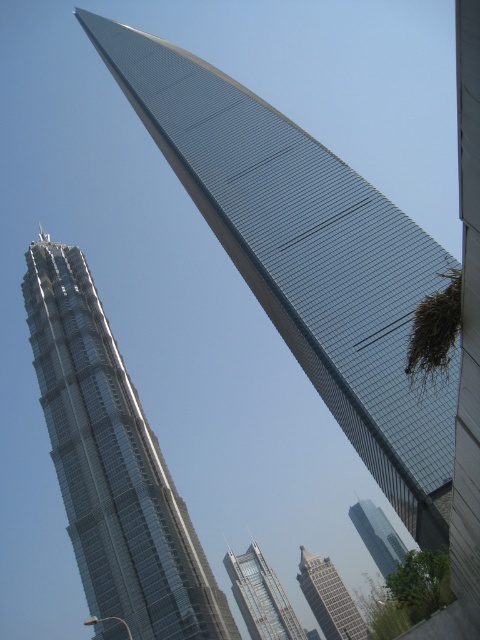
You are standing at the base of the Shanghai Tower and want to take a photo of both point (331,410) and point (384,525) in the frame. Which point will appear closer to you in the photo?

Point (331,410) is in front of point (384,525), so it will appear closer to you in the photo.

You are standing at the center of the image. Which direction should you look to see the shiny glass skyscraper at upper right?

You should look to the upper right direction to see the shiny glass skyscraper at upper right as it is located at point (x=307, y=259).

You are standing at the center of the image and want to locate the shiny silver skyscraper at left. According to the coordinates provided, in which direction should you look to find it?

The shiny silver skyscraper at left is located at coordinates point (112, 465), which means it is positioned to the left and slightly above the center of the image. Since you are standing at the center, you should look to your left and slightly upwards to find it.